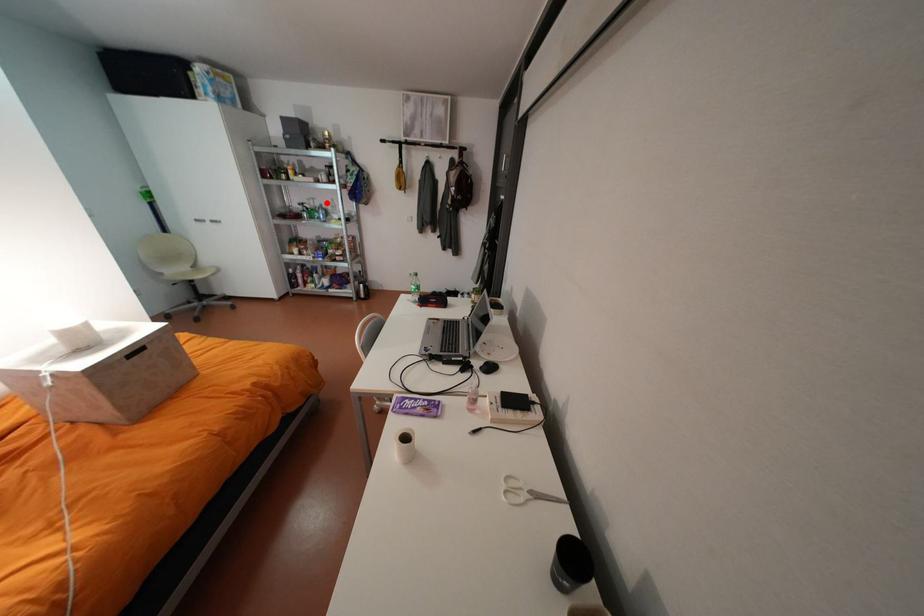
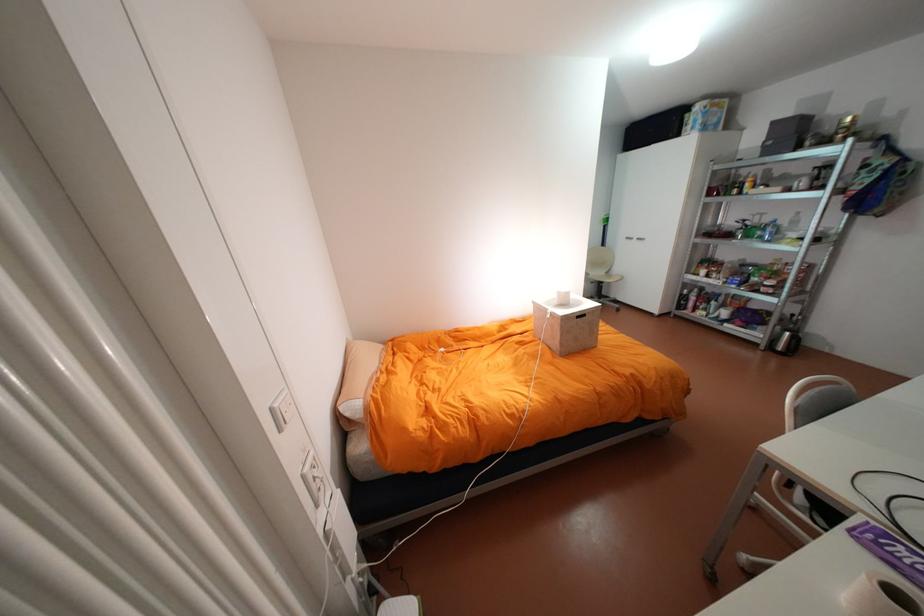
In the second image, find the point that corresponds to the highlighted location in the first image.

(775, 219)